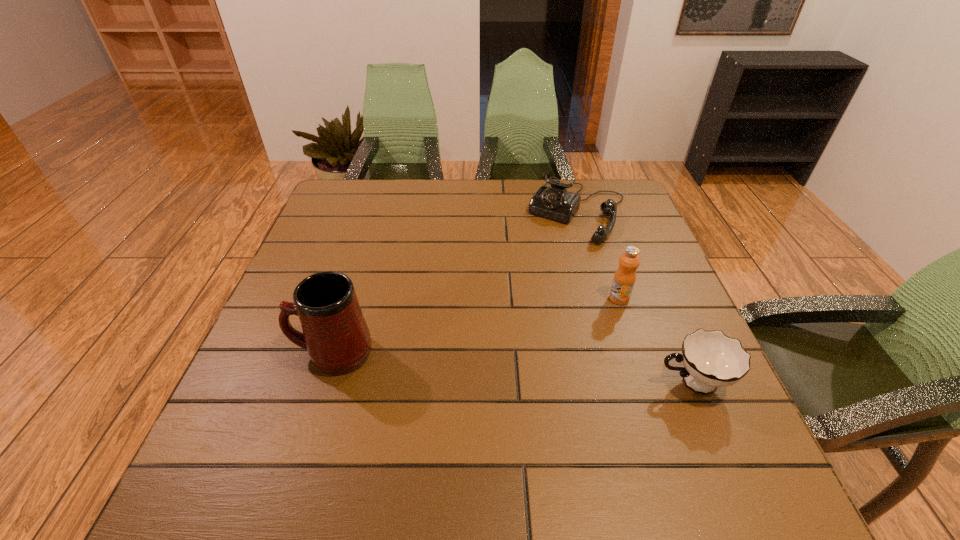
Find the location of `free space on the desktop that is between the tallest object and the cup and is positioned on the front label of the orange juice`. free space on the desktop that is between the tallest object and the cup and is positioned on the front label of the orange juice is located at coordinates (541, 370).

At what (x,y) coordinates should I click in order to perform the action: click on vacant space on the desktop that is between the mug and the cup and is positioned on the dial of the farthest object. Please return your answer as a coordinate pair (x, y). The width and height of the screenshot is (960, 540). Looking at the image, I should click on (481, 365).